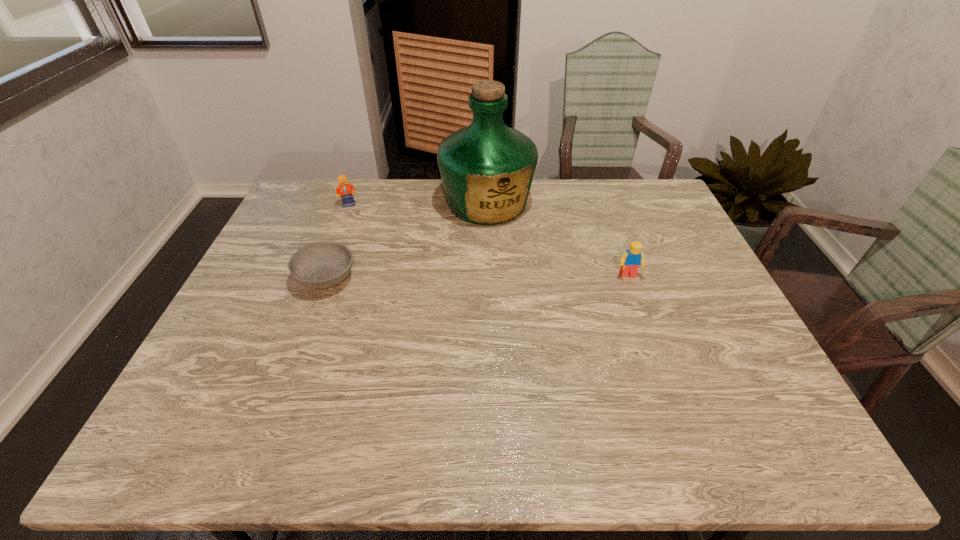
The image size is (960, 540). In the image, there is a desktop. In order to click on free region at the far left corner in this screenshot , I will do `click(335, 198)`.

Locate an element on the screen. The image size is (960, 540). vacant area at the near left corner of the desktop is located at coordinates (207, 397).

Find the location of a particular element. vacant space at the far right corner is located at coordinates (618, 179).

What are the coordinates of `vacant region at the near right corner of the desktop` in the screenshot? It's located at (720, 378).

Where is `empty location between the second object from right to left and the farther Lego`? The image size is (960, 540). empty location between the second object from right to left and the farther Lego is located at coordinates (418, 204).

The height and width of the screenshot is (540, 960). What are the coordinates of `free space between the liquor and the shortest object` in the screenshot? It's located at (406, 241).

Locate an element on the screen. Image resolution: width=960 pixels, height=540 pixels. free spot between the tallest object and the nearer Lego is located at coordinates (558, 239).

This screenshot has height=540, width=960. In order to click on free space between the liquor and the bowl in this screenshot , I will do `click(406, 241)`.

Where is `vacant space that's between the rightmost object and the farther Lego`? vacant space that's between the rightmost object and the farther Lego is located at coordinates (489, 240).

At what (x,y) coordinates should I click in order to perform the action: click on vacant area that lies between the right Lego and the left Lego. Please return your answer as a coordinate pair (x, y). The height and width of the screenshot is (540, 960). Looking at the image, I should click on (489, 240).